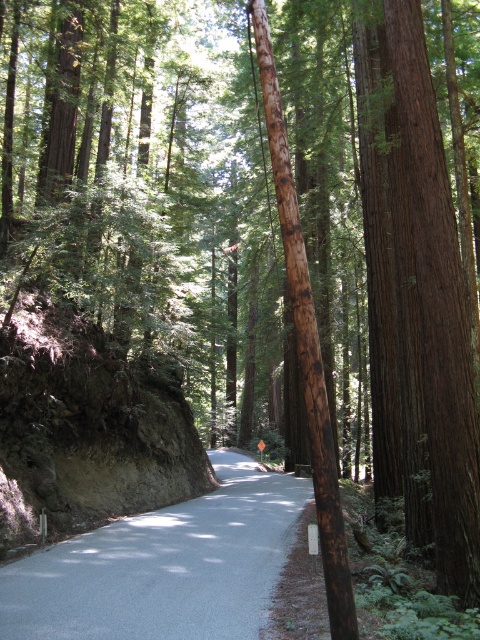
Measure the distance between brown rough textured tree at right and camera.

The distance of brown rough textured tree at right from camera is 24.07 feet.

Is point (414, 186) behind point (225, 522)?

No.

Does point (468, 483) come farther from viewer compared to point (24, 586)?

No.

Identify the location of brown rough textured tree at right. (417, 301).

Does brown rough textured tree at right have a greater width compared to brown rough wooden pole at center?

Yes.

Can you confirm if brown rough textured tree at right is positioned to the left of brown rough wooden pole at center?

Incorrect, brown rough textured tree at right is not on the left side of brown rough wooden pole at center.

Describe the element at coordinates (417, 301) in the screenshot. I see `brown rough textured tree at right` at that location.

You are a GUI agent. You are given a task and a screenshot of the screen. Output one action in this format:
    pyautogui.click(x=<x>, y=<y>)
    Task: Click on the brown rough textured tree at right
    This screenshot has height=640, width=480.
    Given the screenshot: What is the action you would take?
    pyautogui.click(x=417, y=301)

How much distance is there between gray asphalt road at center and brown rough wooden pole at center?

A distance of 39.58 feet exists between gray asphalt road at center and brown rough wooden pole at center.

Is point (247, 596) closer to viewer compared to point (342, 544)?

No, (247, 596) is further to viewer.

Identify the location of gray asphalt road at center. This screenshot has height=640, width=480. (164, 566).